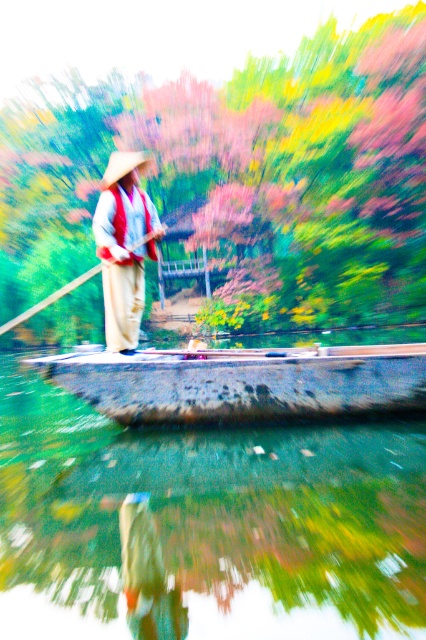
Is matte beige hat at center to the right of wooden paddle at center from the viewer's perspective?

Indeed, matte beige hat at center is positioned on the right side of wooden paddle at center.

Does point (132, 152) lie behind point (29, 307)?

That is False.

This screenshot has width=426, height=640. In order to click on matte beige hat at center in this screenshot , I will do point(123,246).

Does wooden boat at center appear on the right side of wooden paddle at center?

Indeed, wooden boat at center is positioned on the right side of wooden paddle at center.

Image resolution: width=426 pixels, height=640 pixels. Describe the element at coordinates (244, 381) in the screenshot. I see `wooden boat at center` at that location.

Locate an element on the screen. The image size is (426, 640). wooden boat at center is located at coordinates (244, 381).

Is wooden boat at center positioned before matte beige hat at center?

Yes, it is in front of matte beige hat at center.

Does point (327, 355) come in front of point (135, 218)?

No, it is not.

Find the location of `wooden boat at center`. wooden boat at center is located at coordinates tap(244, 381).

Where is `wooden boat at center`? This screenshot has width=426, height=640. wooden boat at center is located at coordinates (244, 381).